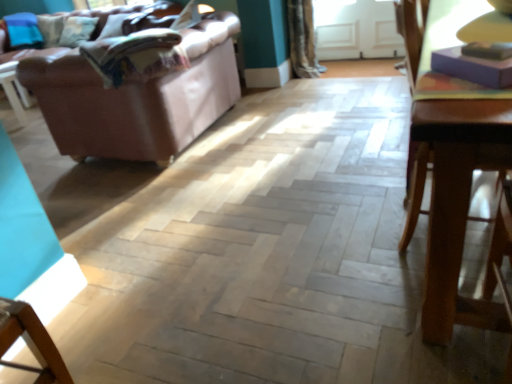
Locate an element on the screen. The width and height of the screenshot is (512, 384). wooden table at right is located at coordinates (450, 162).

The height and width of the screenshot is (384, 512). I want to click on wooden table at right, so click(450, 162).

Can you confirm if wooden table at right is shorter than purple matte book at upper right?

No, wooden table at right is not shorter than purple matte book at upper right.

Would you say wooden table at right is to the left or to the right of purple matte book at upper right in the picture?

wooden table at right is positioned on purple matte book at upper right's right side.

Between point (446, 123) and point (494, 62), which one is positioned behind?

Point (494, 62)

Is wooden table at right not inside purple matte book at upper right?

wooden table at right lies outside purple matte book at upper right's area.

Which point is more distant from viewer, (511, 74) or (494, 327)?

The point (494, 327) is more distant.

Is purple matte book at upper right facing away from wooden table at right?

No, wooden table at right is not at the back of purple matte book at upper right.

Considering the relative sizes of purple matte book at upper right and wooden table at right in the image provided, is purple matte book at upper right wider than wooden table at right?

In fact, purple matte book at upper right might be narrower than wooden table at right.

Considering the relative sizes of purple matte book at upper right and wooden table at right in the image provided, is purple matte book at upper right taller than wooden table at right?

In fact, purple matte book at upper right may be shorter than wooden table at right.

In the scene shown: Considering the relative sizes of brown leather couch at upper left and transparent glass door at upper center in the image provided, is brown leather couch at upper left taller than transparent glass door at upper center?

Correct, brown leather couch at upper left is much taller as transparent glass door at upper center.

From a real-world perspective, between brown leather couch at upper left and transparent glass door at upper center, who is vertically lower?

From a 3D spatial view, transparent glass door at upper center is below.

Does brown leather couch at upper left turn towards transparent glass door at upper center?

No, brown leather couch at upper left does not turn towards transparent glass door at upper center.

Would you say brown leather couch at upper left contains transparent glass door at upper center?

Definitely not — transparent glass door at upper center is not inside brown leather couch at upper left.

Who is smaller, wooden table at right or textured beige curtain at upper center?

textured beige curtain at upper center is smaller.

Is wooden table at right oriented away from textured beige curtain at upper center?

wooden table at right is not turned away from textured beige curtain at upper center.

Locate an element on the screen. table on the right of the textured beige curtain at upper center is located at coordinates (450, 162).

Considering the positions of objects wooden table at right and textured beige curtain at upper center in the image provided, who is more to the left, wooden table at right or textured beige curtain at upper center?

textured beige curtain at upper center.

From a real-world perspective, between transparent glass door at upper center and brown leather couch at upper left, who is vertically lower?

In real-world perspective, transparent glass door at upper center is lower.

Which object is thinner, transparent glass door at upper center or brown leather couch at upper left?

transparent glass door at upper center is thinner.

Is transparent glass door at upper center at the left side of brown leather couch at upper left?

In fact, transparent glass door at upper center is to the right of brown leather couch at upper left.

How many degrees apart are the facing directions of wooden table at right and transparent glass door at upper center?

They differ by 87.8 degrees in their facing directions.

Which object is more forward, wooden table at right or transparent glass door at upper center?

wooden table at right is in front.

How distant is wooden table at right from transparent glass door at upper center?

They are 9.05 feet apart.

Considering the sizes of objects wooden table at right and transparent glass door at upper center in the image provided, who is taller, wooden table at right or transparent glass door at upper center?

wooden table at right.

Is textured beige curtain at upper center facing away from wooden table at right?

That's not correct — textured beige curtain at upper center is not looking away from wooden table at right.

From the image's perspective, is textured beige curtain at upper center located above wooden table at right?

Yes.

In the image, there is a purple matte book at upper right. At what (x,y) coordinates should I click in order to perform the action: click on table below it (from a real-world perspective). Please return your answer as a coordinate pair (x, y). The image size is (512, 384). Looking at the image, I should click on (450, 162).

Identify the location of table in front of the purple matte book at upper right. This screenshot has height=384, width=512. tap(450, 162).

Looking at the image, which one is located closer to wooden table at right, textured beige curtain at upper center or transparent glass door at upper center?

The object closer to wooden table at right is textured beige curtain at upper center.

When comparing their distances from wooden table at right, does transparent glass door at upper center or purple matte book at upper right seem further?

transparent glass door at upper center is further to wooden table at right.

From the image, which object appears to be nearer to purple matte book at upper right, transparent glass door at upper center or brown leather couch at upper left?

Among the two, brown leather couch at upper left is located nearer to purple matte book at upper right.

Estimate the real-world distances between objects in this image. Which object is closer to wooden table at right, brown leather couch at upper left or purple matte book at upper right?

The object closer to wooden table at right is purple matte book at upper right.

Based on their spatial positions, is textured beige curtain at upper center or transparent glass door at upper center closer to brown leather couch at upper left?

textured beige curtain at upper center is positioned closer to the anchor brown leather couch at upper left.

Which object lies further to the anchor point transparent glass door at upper center, purple matte book at upper right or wooden table at right?

A: purple matte book at upper right lies further to transparent glass door at upper center than the other object.

In the scene shown: From the image, which object appears to be nearer to textured beige curtain at upper center, purple matte book at upper right or transparent glass door at upper center?

transparent glass door at upper center is positioned closer to the anchor textured beige curtain at upper center.

Looking at the image, which one is located further to transparent glass door at upper center, wooden table at right or purple matte book at upper right?

purple matte book at upper right.

At what (x,y) coordinates should I click in order to perform the action: click on book situated between brown leather couch at upper left and wooden table at right from left to right. Please return your answer as a coordinate pair (x, y). Looking at the image, I should click on (477, 63).

The image size is (512, 384). In order to click on curtain positioned between brown leather couch at upper left and transparent glass door at upper center from near to far in this screenshot , I will do `click(302, 39)`.

Locate an element on the screen. curtain between wooden table at right and transparent glass door at upper center in the front-back direction is located at coordinates (302, 39).

In order to click on book located between wooden table at right and transparent glass door at upper center in the depth direction in this screenshot , I will do `click(477, 63)`.